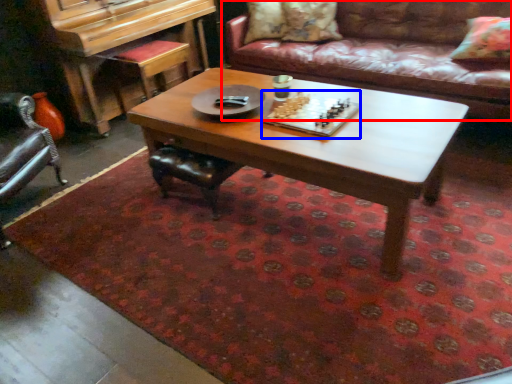
Question: Which object is further to the camera taking this photo, studio couch (highlighted by a red box) or board game (highlighted by a blue box)?

Choices:
 (A) studio couch
 (B) board game

Answer: (A)